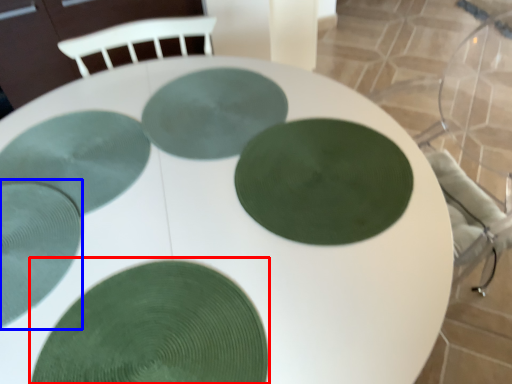
Question: Which object is further to the camera taking this photo, glass plate (highlighted by a red box) or glass plate (highlighted by a blue box)?

Choices:
 (A) glass plate
 (B) glass plate

Answer: (B)